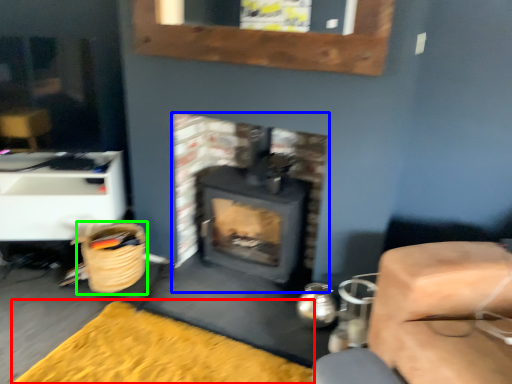
Question: Based on their relative distances, which object is nearer to doormat (highlighted by a red box)? Choose from wood burning stove (highlighted by a blue box) and basket (highlighted by a green box).

Choices:
 (A) wood burning stove
 (B) basket

Answer: (B)